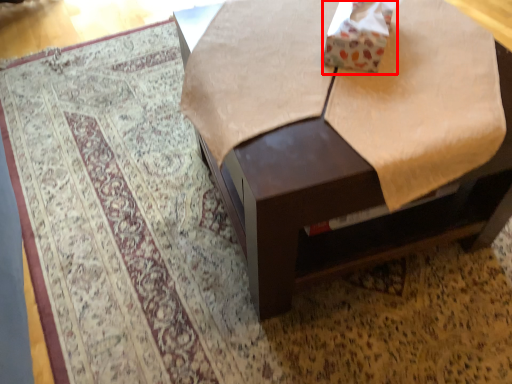
Question: From the image's perspective, considering the relative positions of cardboard box (annotated by the red box) and table in the image provided, where is cardboard box (annotated by the red box) located with respect to the staircase?

Choices:
 (A) below
 (B) above

Answer: (B)